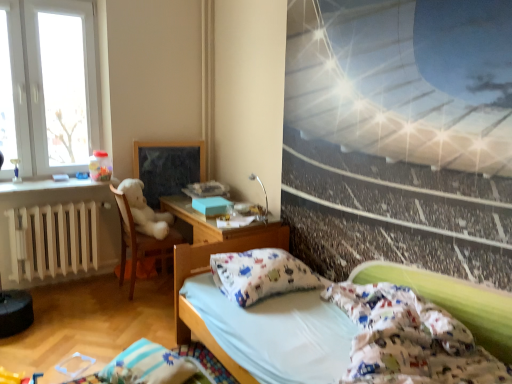
Question: Does matte black picture frame at center have a larger size compared to white glass window at upper left?

Choices:
 (A) no
 (B) yes

Answer: (A)

Question: Is matte black picture frame at center thinner than white glass window at upper left?

Choices:
 (A) no
 (B) yes

Answer: (B)

Question: Does matte black picture frame at center have a greater width compared to white glass window at upper left?

Choices:
 (A) yes
 (B) no

Answer: (B)

Question: Can you confirm if matte black picture frame at center is taller than white glass window at upper left?

Choices:
 (A) yes
 (B) no

Answer: (B)

Question: Does matte black picture frame at center come behind white glass window at upper left?

Choices:
 (A) no
 (B) yes

Answer: (B)

Question: Can you confirm if matte black picture frame at center is shorter than white glass window at upper left?

Choices:
 (A) no
 (B) yes

Answer: (B)

Question: Can you confirm if white cotton bed at lower right is positioned to the right of matte black picture frame at center?

Choices:
 (A) yes
 (B) no

Answer: (A)

Question: Can you confirm if white cotton bed at lower right is smaller than matte black picture frame at center?

Choices:
 (A) yes
 (B) no

Answer: (B)

Question: Is white cotton bed at lower right shorter than matte black picture frame at center?

Choices:
 (A) no
 (B) yes

Answer: (B)

Question: Can we say white cotton bed at lower right lies outside matte black picture frame at center?

Choices:
 (A) yes
 (B) no

Answer: (A)

Question: Can you confirm if white cotton bed at lower right is wider than matte black picture frame at center?

Choices:
 (A) yes
 (B) no

Answer: (A)

Question: From the image's perspective, would you say white cotton bed at lower right is shown under matte black picture frame at center?

Choices:
 (A) no
 (B) yes

Answer: (B)

Question: Is matte black picture frame at center taller than white cotton bed at lower right?

Choices:
 (A) yes
 (B) no

Answer: (A)